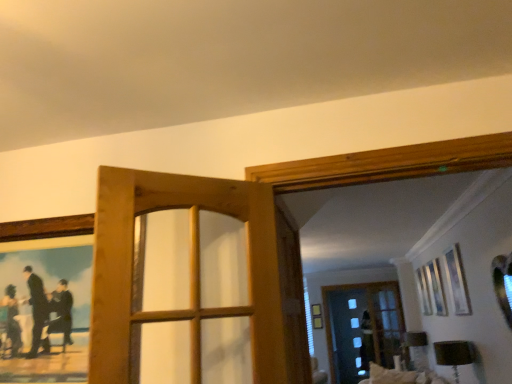
Question: Is wooden picture frame at upper left oriented towards wooden door at center?

Choices:
 (A) yes
 (B) no

Answer: (B)

Question: Are wooden picture frame at upper left and wooden door at center making contact?

Choices:
 (A) no
 (B) yes

Answer: (A)

Question: Does wooden picture frame at upper left have a smaller size compared to wooden door at center?

Choices:
 (A) yes
 (B) no

Answer: (A)

Question: Is the position of wooden picture frame at upper left less distant than that of wooden door at center?

Choices:
 (A) yes
 (B) no

Answer: (B)

Question: Is wooden picture frame at upper left at the left side of wooden door at center?

Choices:
 (A) no
 (B) yes

Answer: (B)

Question: Can you confirm if wooden picture frame at upper left is taller than wooden door at center?

Choices:
 (A) no
 (B) yes

Answer: (A)

Question: Is transparent glass screen door at center surrounded by wooden door at center?

Choices:
 (A) no
 (B) yes

Answer: (A)

Question: Considering the relative sizes of wooden door at center and transparent glass screen door at center in the image provided, is wooden door at center taller than transparent glass screen door at center?

Choices:
 (A) yes
 (B) no

Answer: (B)

Question: Is wooden door at center thinner than transparent glass screen door at center?

Choices:
 (A) yes
 (B) no

Answer: (B)

Question: Is wooden door at center closer to the viewer compared to transparent glass screen door at center?

Choices:
 (A) no
 (B) yes

Answer: (B)

Question: Is wooden door at center further to the viewer compared to transparent glass screen door at center?

Choices:
 (A) yes
 (B) no

Answer: (B)

Question: Is wooden door at center not within transparent glass screen door at center?

Choices:
 (A) no
 (B) yes

Answer: (B)

Question: Is wooden door at center turned away from wooden picture frame at upper left?

Choices:
 (A) yes
 (B) no

Answer: (A)